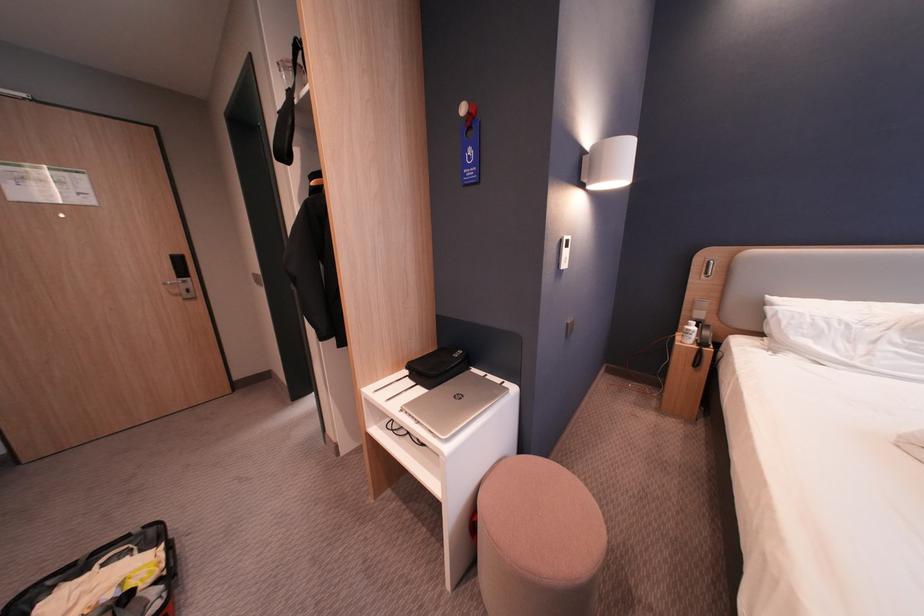
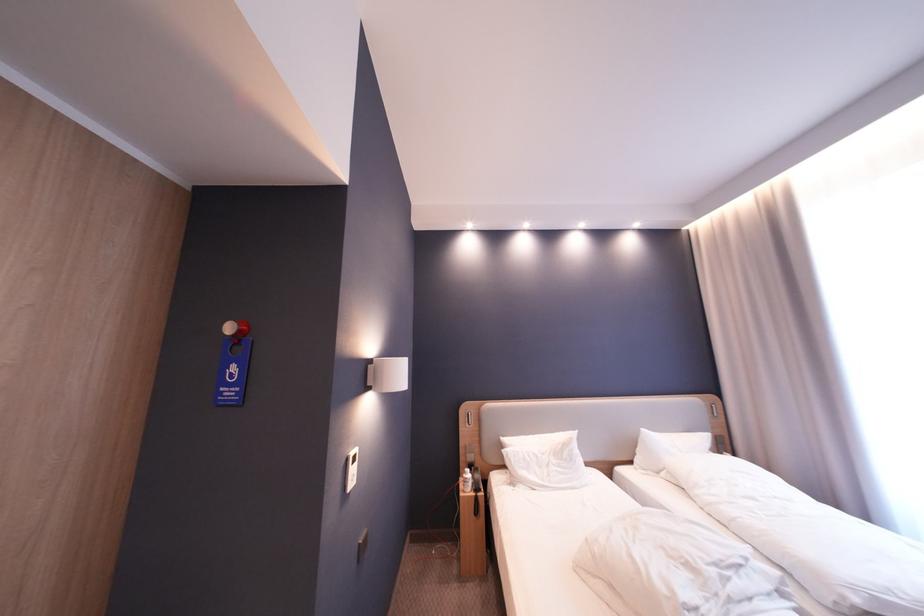
Where in the second image is the point corresponding to (x=475, y=110) from the first image?

(240, 329)